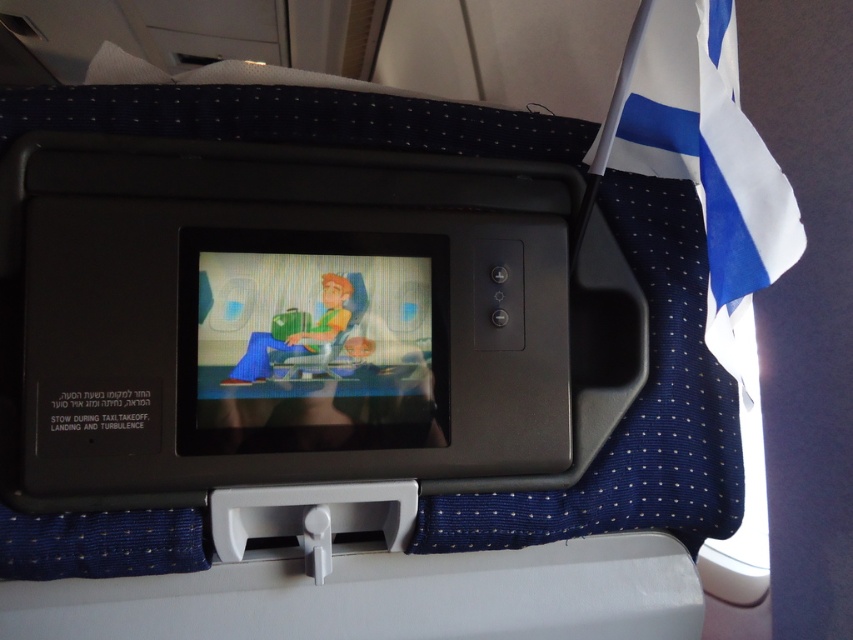
You are a passenger sitting in the airplane seat and want to adjust the entertainment screen. The point you need to reach is point (378, 356). Your hand can extend 24 inches from your seat. Can you reach it?

The point (378, 356) is 22.95 inches away from the camera, so yes, your hand can reach it since it extends 24 inches from your seat.

You are a flight attendant checking the entertainment systems. You notice the matte plastic screen at center and the blue fabric flag at upper right. Which object is larger in size?

The blue fabric flag at upper right is larger in size compared to the matte plastic screen at center.

You are a flight attendant checking the in flight entertainment system. You need to ensure that the matte plastic screen at center is wider than the blue fabric flag at upper right. Based on the scene description, is this requirement met?

The matte plastic screen at center has a width that surpasses the blue fabric flag at upper right, so the requirement is met.